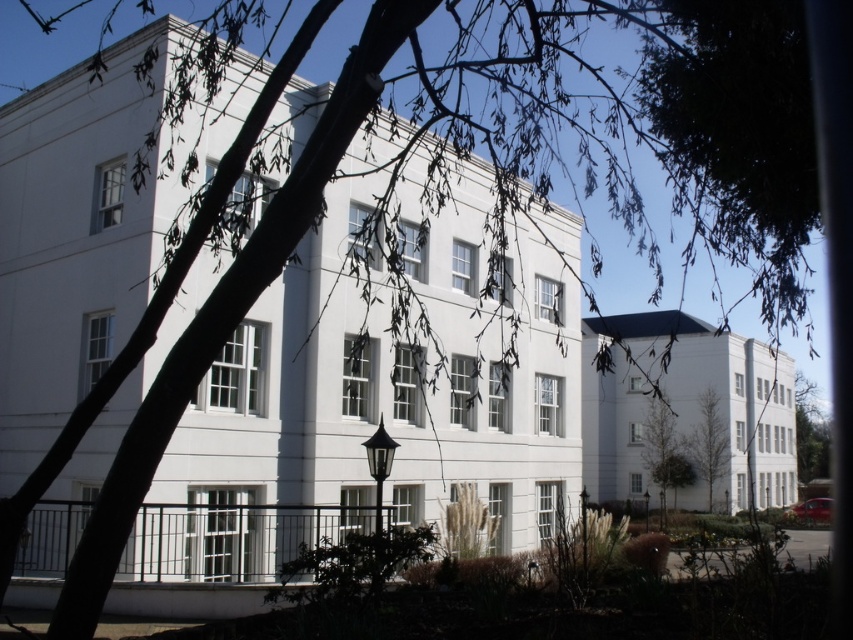
Question: Is the position of green leafy tree at lower right less distant than that of green leafy tree at center?

Choices:
 (A) no
 (B) yes

Answer: (B)

Question: Among these objects, which one is nearest to the camera?

Choices:
 (A) green leafy tree at right
 (B) green leafy tree at center
 (C) green leafy tree at lower right

Answer: (C)

Question: Estimate the real-world distances between objects in this image. Which object is farther from the green leafy tree at lower right?

Choices:
 (A) green leafy tree at right
 (B) green leafy tree at center

Answer: (A)

Question: Which point is closer to the camera?

Choices:
 (A) (666, 417)
 (B) (712, 483)

Answer: (B)

Question: Is green leafy tree at center closer to camera compared to green leafy tree at right?

Choices:
 (A) yes
 (B) no

Answer: (A)

Question: Is green leafy tree at lower right bigger than green leafy tree at right?

Choices:
 (A) yes
 (B) no

Answer: (B)